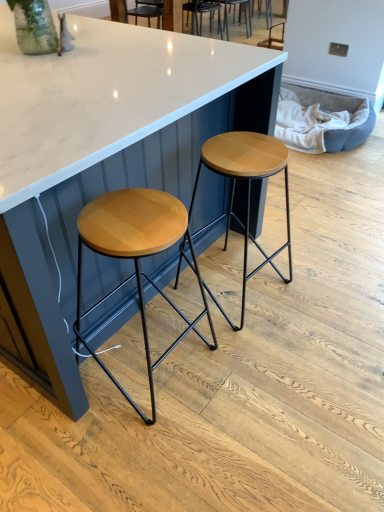
The image size is (384, 512). I want to click on vacant region under wooden matte stool at center, the first stool viewed from the right (from a real-world perspective), so click(x=240, y=289).